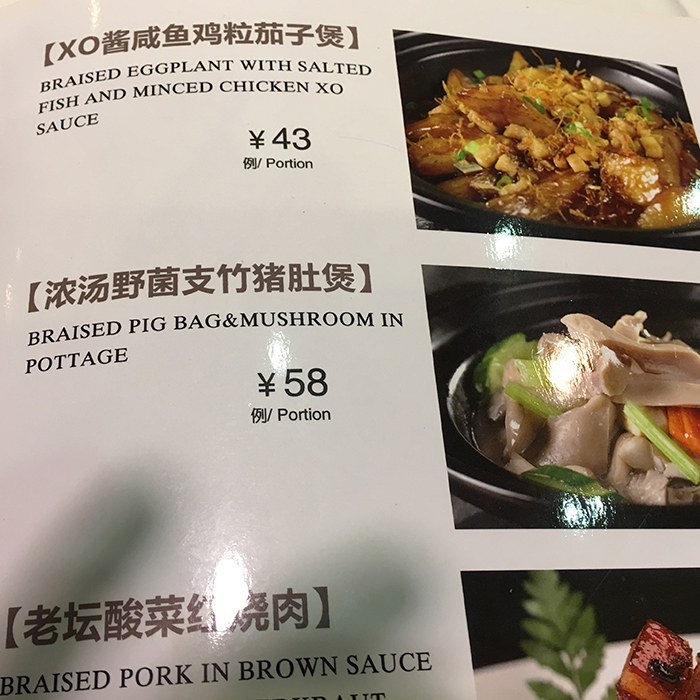
Locate an element on the screen. bowl is located at coordinates (612, 144).